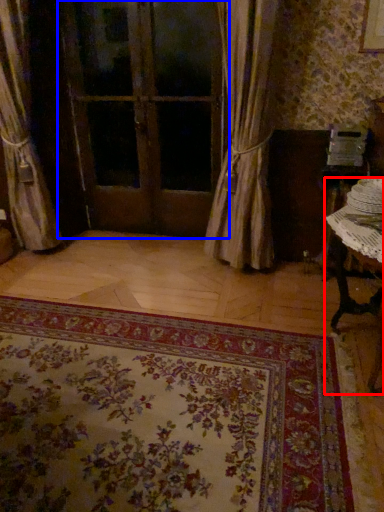
Question: Which point is further to the camera, table (highlighted by a red box) or door (highlighted by a blue box)?

Choices:
 (A) table
 (B) door

Answer: (B)